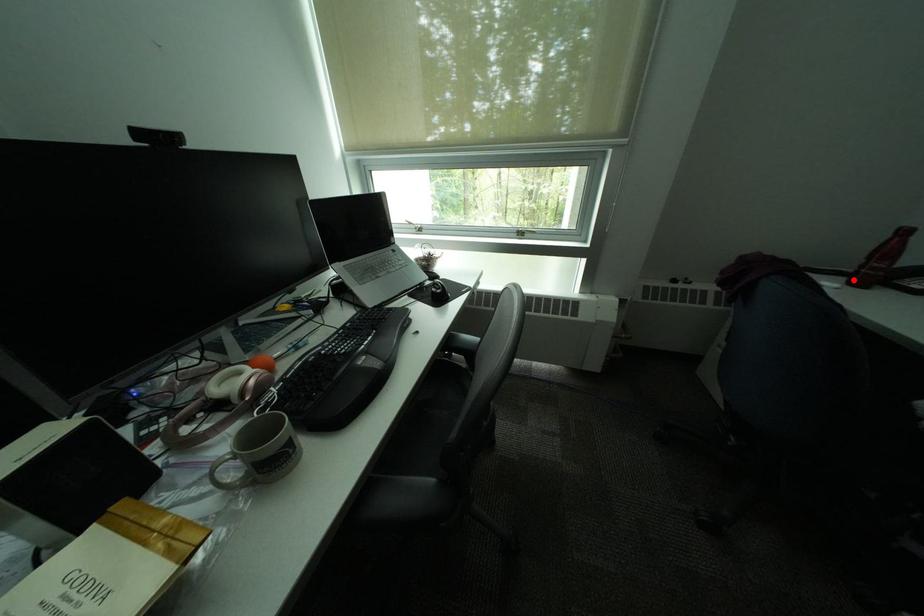
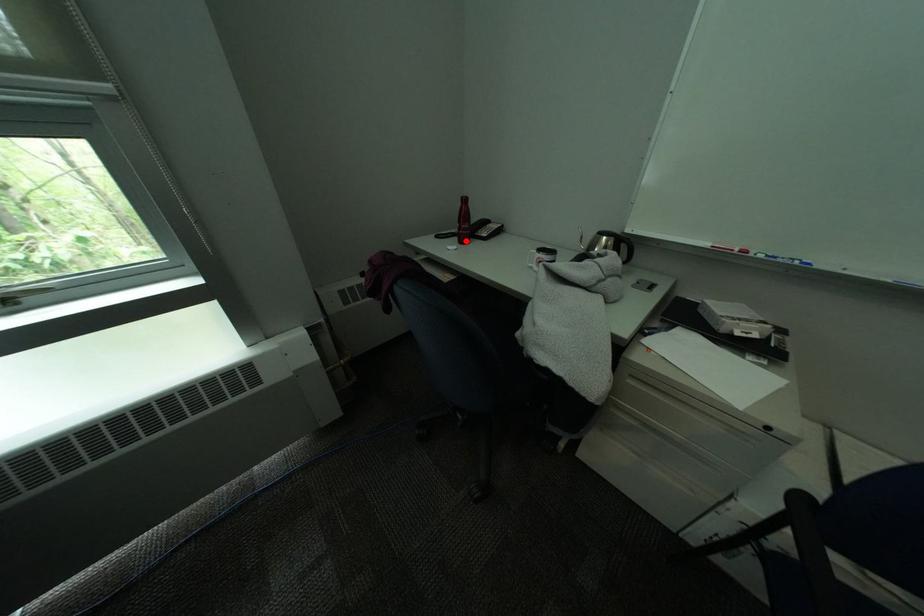
I am providing you with two images of the same scene from different viewpoints. A red point is marked on the first image and another point is marked on the second image. Do the highlighted points in image1 and image2 indicate the same real-world spot?

Yes